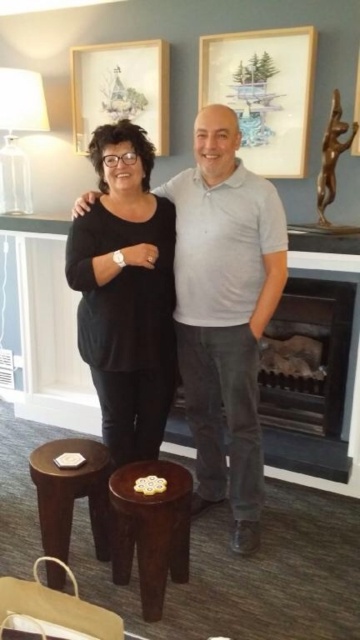
You are a painter standing in front of the dark brown wooden stool at center and want to paint the wooden picture frame at upper center. Can you paint it without moving the stool?

The wooden picture frame at upper center is further to the viewer than dark brown wooden stool at center, so you can paint it without moving the stool because it is in front of the stool and accessible.

You are a photographer adjusting your camera to focus on two points in the image. The first point is point (206, 100) and the second is point (104, 513). Which point is closer to the camera?

Point (206, 100) is closer to the camera than point (104, 513) because it is further to the camera.

You are standing in the living room and want to hang a new picture frame. The wooden picture frame at upper center is currently at coordinates 0.145 on the horizontal axis and 0.733 on the vertical axis. If you want to place a new frame directly to the right of the existing one, what should be the approximate horizontal coordinate for the new frame?

The wooden picture frame at upper center is located at point (263,92). To place a new frame directly to the right, you should adjust the horizontal coordinate slightly higher than 0.145 while keeping the vertical coordinate at 0.733.